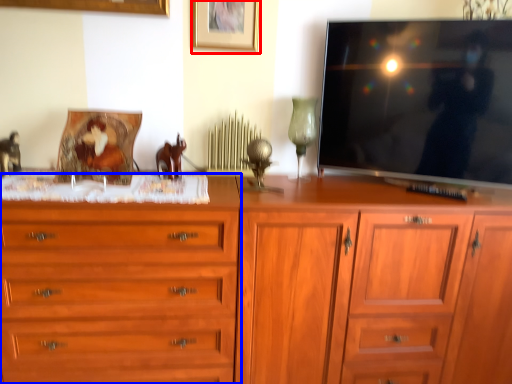
Question: Which object appears closest to the camera in this image, picture frame (highlighted by a red box) or chest of drawers (highlighted by a blue box)?

Choices:
 (A) picture frame
 (B) chest of drawers

Answer: (B)